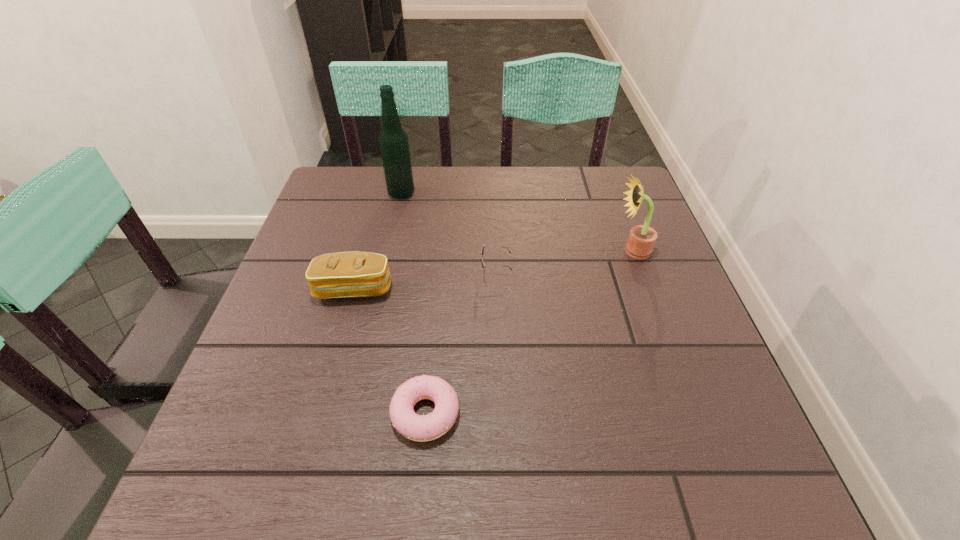
This screenshot has height=540, width=960. Find the location of `free space between the second object from right to left and the nearest object`. free space between the second object from right to left and the nearest object is located at coordinates (461, 344).

What are the coordinates of `free space between the sunglasses and the clutch bag` in the screenshot? It's located at (424, 282).

Find the location of a particular element. The image size is (960, 540). free space between the sunglasses and the doughnut is located at coordinates (461, 344).

Image resolution: width=960 pixels, height=540 pixels. Identify the location of vacant space that is in between the clutch bag and the third object from left to right. (390, 351).

Locate an element on the screen. free space between the alcohol and the rightmost object is located at coordinates (516, 222).

Locate an element on the screen. The width and height of the screenshot is (960, 540). unoccupied area between the alcohol and the shortest object is located at coordinates (x=414, y=303).

You are a GUI agent. You are given a task and a screenshot of the screen. Output one action in this format:
    pyautogui.click(x=<x>, y=<y>)
    Task: Click on the object identified as the fourth closest to the sunglasses
    Image resolution: width=960 pixels, height=540 pixels.
    Given the screenshot: What is the action you would take?
    pyautogui.click(x=393, y=140)

Locate an element on the screen. object that is the fourth closest one to the rightmost object is located at coordinates (393, 140).

Find the location of a particular element. vacant area that satisfies the following two spatial constraints: 1. on the face of the sunflower; 2. on the zipper side of the clutch bag is located at coordinates [x=646, y=289].

Locate an element on the screen. The image size is (960, 540). free space that satisfies the following two spatial constraints: 1. on the zipper side of the clutch bag; 2. on the left side of the nearest object is located at coordinates tap(320, 414).